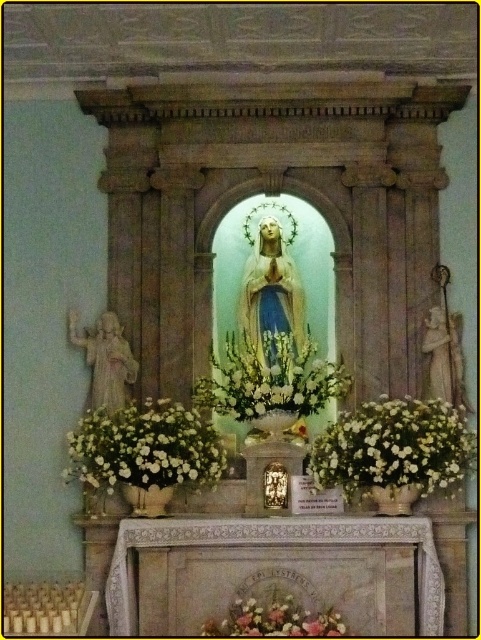
From the picture: Between white matte floral arrangement at center and white floral arrangement at center, which one appears on the left side from the viewer's perspective?

white floral arrangement at center is more to the left.

Which of these two, white matte floral arrangement at center or white floral arrangement at center, stands taller?

white matte floral arrangement at center is taller.

Describe the element at coordinates (393, 449) in the screenshot. I see `white matte floral arrangement at center` at that location.

The image size is (481, 640). I want to click on white matte floral arrangement at center, so click(x=393, y=449).

Who is positioned more to the right, white matte flowers at center or white floral arrangement at center?

Positioned to the right is white floral arrangement at center.

Which of these two, white matte flowers at center or white floral arrangement at center, stands shorter?

white matte flowers at center is shorter.

Between point (87, 424) and point (255, 419), which one is positioned in front?

Point (87, 424)

At what (x,y) coordinates should I click in order to perform the action: click on white matte flowers at center. Please return your answer as a coordinate pair (x, y). The width and height of the screenshot is (481, 640). Looking at the image, I should click on (146, 448).

Between white matte floral arrangement at center and white matte flowers at center, which one has less height?

Standing shorter between the two is white matte flowers at center.

Between point (457, 419) and point (184, 413), which one is positioned behind?

The point (457, 419) is behind.

The width and height of the screenshot is (481, 640). What are the coordinates of `white matte floral arrangement at center` in the screenshot? It's located at (393, 449).